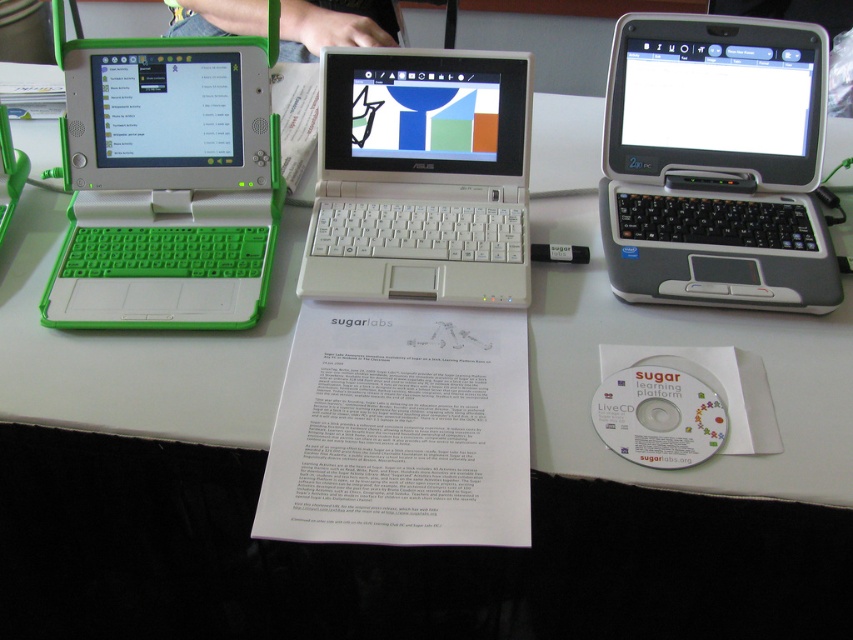
Can you confirm if white paper at center is positioned to the right of gray matte laptop at upper right?

Correct, you'll find white paper at center to the right of gray matte laptop at upper right.

Measure the distance between point [561,202] and camera.

Point [561,202] is 4.02 feet from camera.

The width and height of the screenshot is (853, 640). Identify the location of white paper at center. (682, 344).

Does point (630, 28) come closer to viewer compared to point (231, 17)?

That is True.

Is gray matte laptop at upper right wider than green fabric pants at upper center?

No.

Is point (650, 17) closer to viewer compared to point (343, 1)?

Yes.

In order to click on gray matte laptop at upper right in this screenshot , I will do `click(717, 163)`.

The height and width of the screenshot is (640, 853). What do you see at coordinates (166, 180) in the screenshot?
I see `green matte laptop at left` at bounding box center [166, 180].

Can you confirm if green matte laptop at left is positioned below white plastic laptop at center?

Incorrect, green matte laptop at left is not positioned below white plastic laptop at center.

Is point (119, 76) positioned behind point (509, 156)?

No, (119, 76) is in front of (509, 156).

I want to click on green matte laptop at left, so click(166, 180).